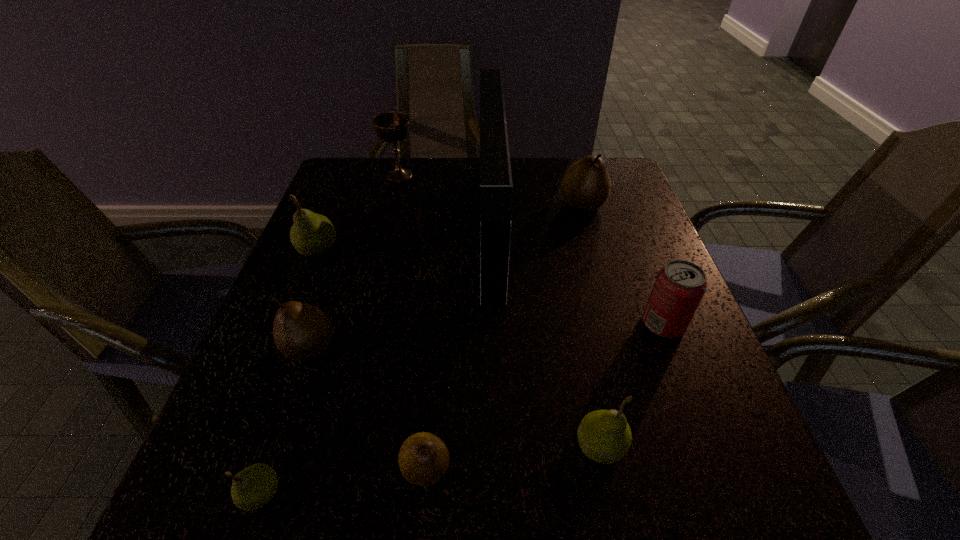
You are a GUI agent. You are given a task and a screenshot of the screen. Output one action in this format:
    pyautogui.click(x=<x>, y=<y>)
    Task: Click on the pear located at the right edge
    
    Given the screenshot: What is the action you would take?
    pyautogui.click(x=586, y=185)

Locate an element on the screen. Image resolution: width=960 pixels, height=540 pixels. soda can at the right edge is located at coordinates (680, 285).

Where is `object situated at the far left corner`? This screenshot has width=960, height=540. object situated at the far left corner is located at coordinates (392, 127).

The width and height of the screenshot is (960, 540). In order to click on object at the near left corner in this screenshot , I will do `click(253, 487)`.

At what (x,y) coordinates should I click in order to perform the action: click on object present at the far right corner. Please return your answer as a coordinate pair (x, y). The width and height of the screenshot is (960, 540). Looking at the image, I should click on (586, 185).

The image size is (960, 540). I want to click on free space at the far edge of the desktop, so click(472, 174).

Where is `free space at the near edge of the desktop`? This screenshot has width=960, height=540. free space at the near edge of the desktop is located at coordinates (322, 486).

In order to click on vacant space at the left edge of the desktop in this screenshot , I will do `click(316, 435)`.

Locate an element on the screen. vacant space at the right edge of the desktop is located at coordinates (605, 284).

I want to click on free space at the far left corner of the desktop, so click(372, 188).